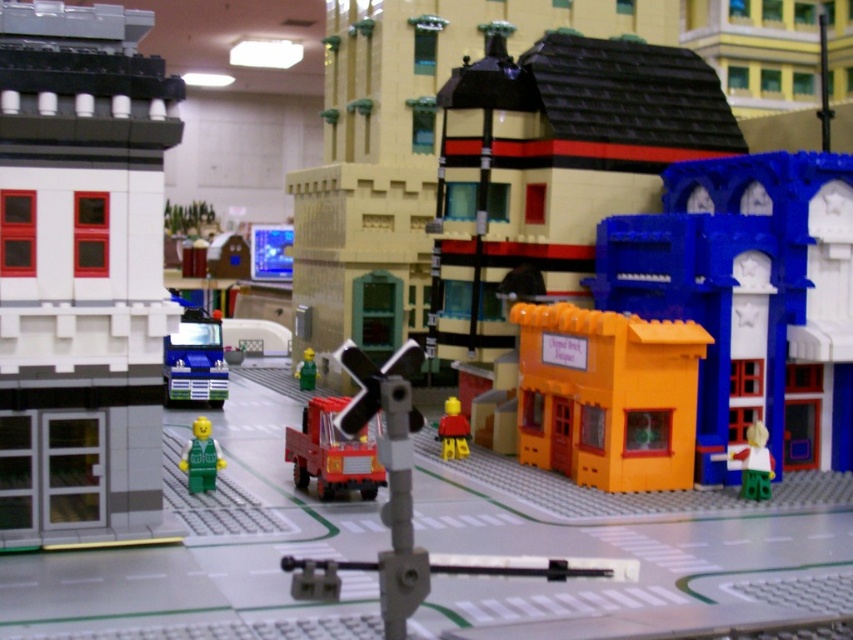
Which of these two, orange matte building at center or green matte minifigure at center, stands shorter?

green matte minifigure at center

Between point (538, 336) and point (202, 449), which one is positioned in front?

Point (202, 449) is in front.

Find the location of a particular element. orange matte building at center is located at coordinates (607, 396).

The width and height of the screenshot is (853, 640). Describe the element at coordinates (755, 461) in the screenshot. I see `white matte figure at lower right` at that location.

Who is higher up, white matte figure at lower right or bright yellow plastic minifigure at center?

Positioned higher is bright yellow plastic minifigure at center.

The image size is (853, 640). Describe the element at coordinates (755, 461) in the screenshot. I see `white matte figure at lower right` at that location.

Where is `white matte figure at lower right`? The image size is (853, 640). white matte figure at lower right is located at coordinates (755, 461).

What do you see at coordinates (80, 273) in the screenshot? I see `white matte building at left` at bounding box center [80, 273].

Is white matte building at left bigger than orange matte building at center?

Yes.

Measure the distance between white matte building at left and camera.

They are 6.82 meters apart.

This screenshot has height=640, width=853. Identify the location of white matte building at left. 80,273.